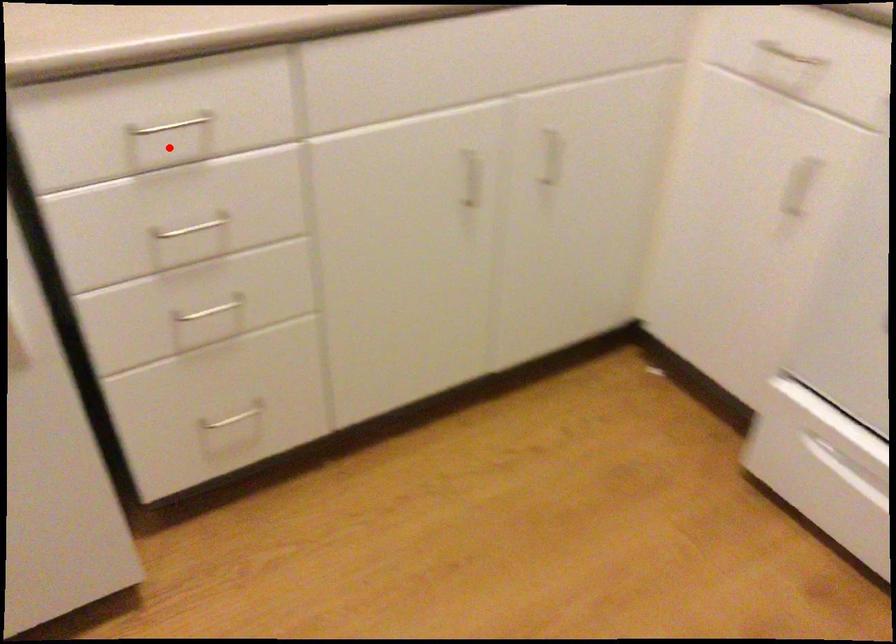
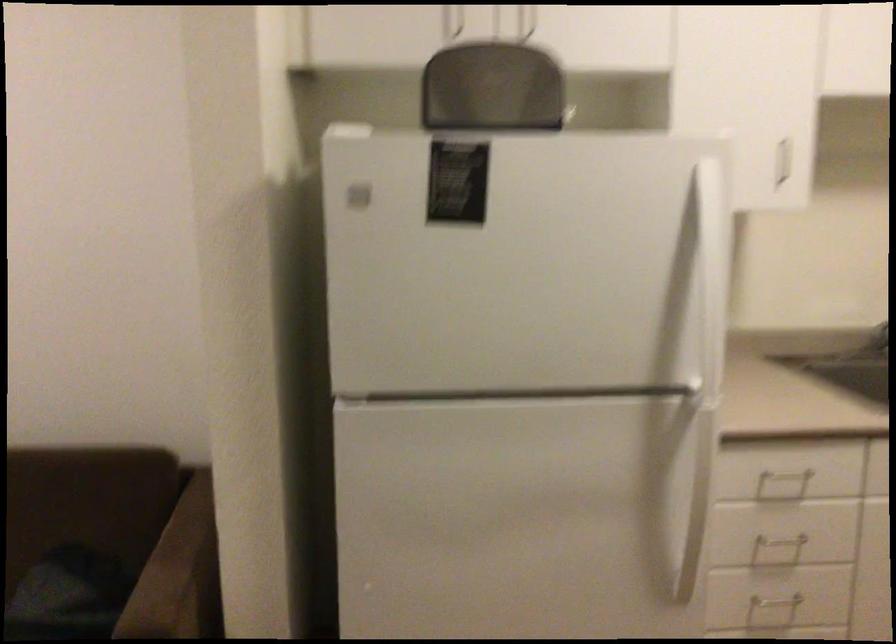
Question: A red point is marked in image1. In image2, is the corresponding 3D point closer to the camera or farther? Reply with the corresponding letter.

Choices:
 (A) The corresponding 3D point is closer.
 (B) The corresponding 3D point is farther.

Answer: (B)